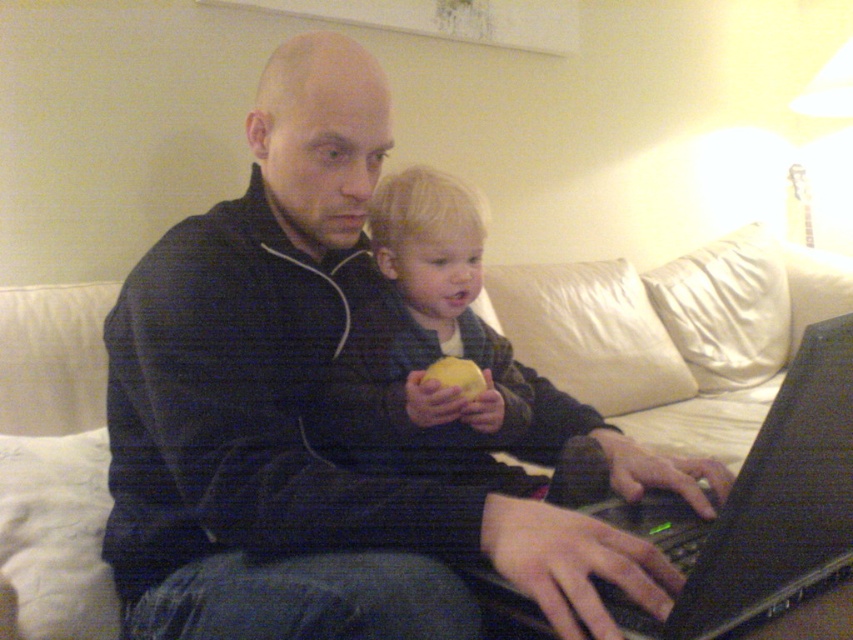
You are a delivery person who needs to place a small package between the black matte jacket at center and the black plastic laptop at center. Can you fit the package there?

The black matte jacket at center is to the left of the black plastic laptop at center, so there is space between them to place the package.

You are standing in the room and want to hand the round object the child is holding to the adult male at the left. Can you reach him without moving the black plastic laptop at center?

The black plastic laptop at center is 22.18 inches away from you, so if you can reach that distance, you can hand the round object to the adult male at the left without moving the laptop.

You are a parent trying to decide if you can place both the black plastic laptop at center and the yellow matte apple at center on a small table that can only hold items totaling up to 15 inches in combined size. The laptop measures 12 inches in length. Can both items fit on the table?

The black plastic laptop at center is bigger than the yellow matte apple at center. Since the laptop is already 12 inches long, adding the smaller apple would exceed the 15 inch limit unless the apple is 3 inches or smaller. Without knowing the apple size, it is uncertain if both can fit.